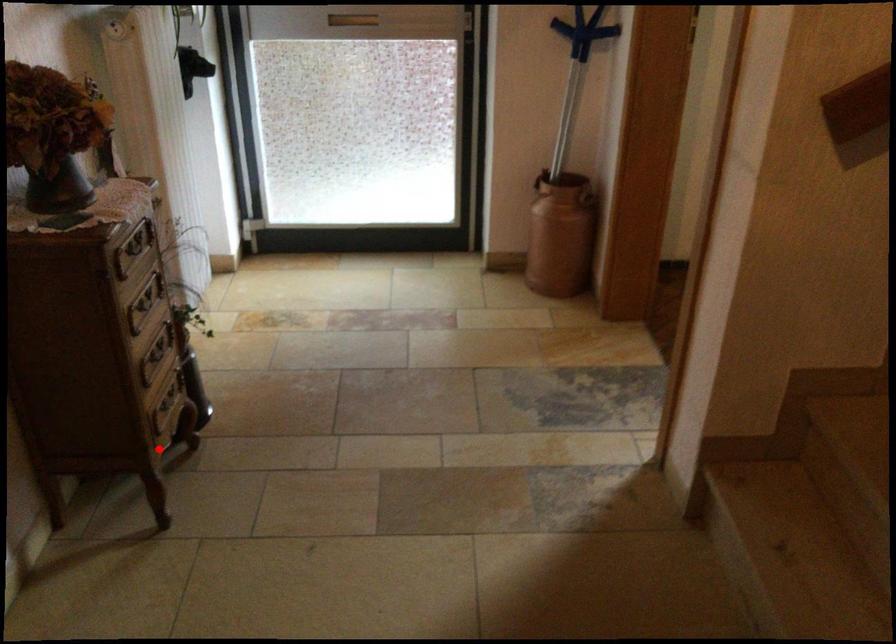
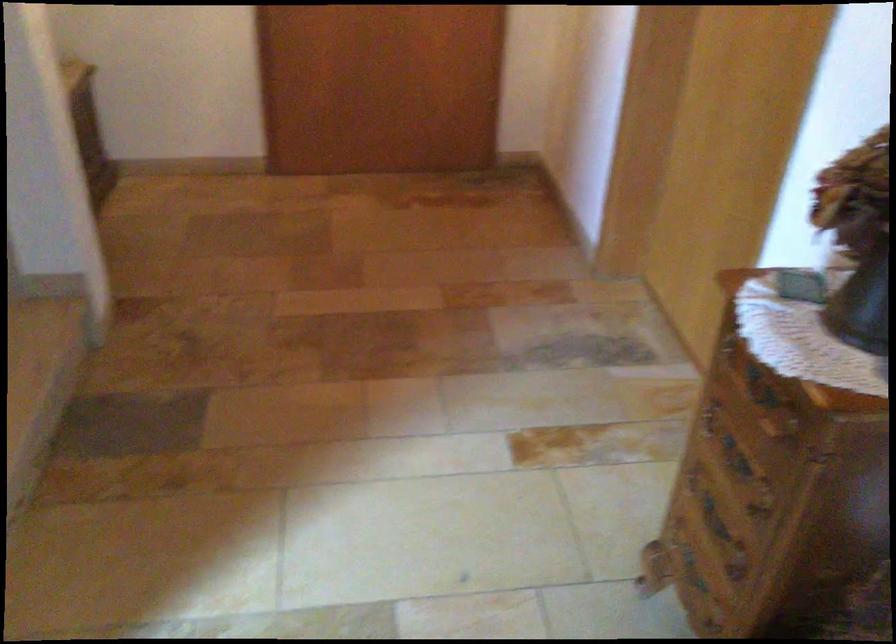
The point at the highlighted location is marked in the first image. Where is the corresponding point in the second image?

(693, 571)